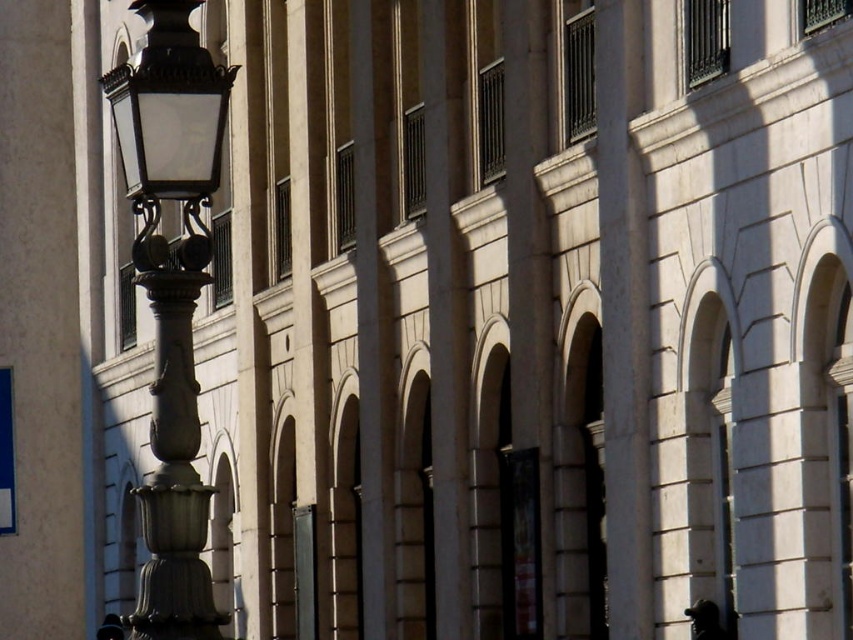
Question: Is black glossy statue at lower right wider than smooth black hat at lower left?

Choices:
 (A) yes
 (B) no

Answer: (B)

Question: Which object is the farthest from the smooth black hat at lower left?

Choices:
 (A) polished brass streetlight at left
 (B) black glossy statue at lower right

Answer: (B)

Question: Which of the following is the closest to the observer?

Choices:
 (A) black glossy statue at lower right
 (B) polished brass streetlight at left

Answer: (B)

Question: Does polished brass streetlight at left have a larger size compared to smooth black hat at lower left?

Choices:
 (A) yes
 (B) no

Answer: (A)

Question: Does polished brass streetlight at left have a larger size compared to smooth black hat at lower left?

Choices:
 (A) no
 (B) yes

Answer: (B)

Question: Which object is closer to the camera taking this photo?

Choices:
 (A) black glossy statue at lower right
 (B) polished brass streetlight at left
 (C) smooth black hat at lower left

Answer: (B)